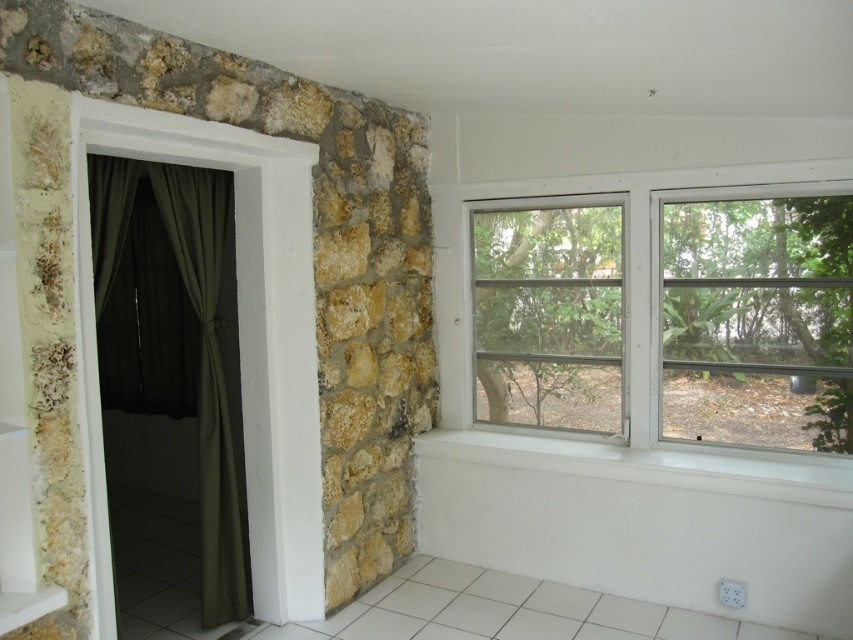
Is clear glass window at upper right thinner than green fabric curtain at left?

Incorrect, clear glass window at upper right's width is not less than green fabric curtain at left's.

Consider the image. Is clear glass window at upper right taller than green fabric curtain at left?

No.

Is point (517, 188) positioned behind point (158, 340)?

No, it is in front of (158, 340).

What are the coordinates of `clear glass window at upper right` in the screenshot? It's located at (625, 342).